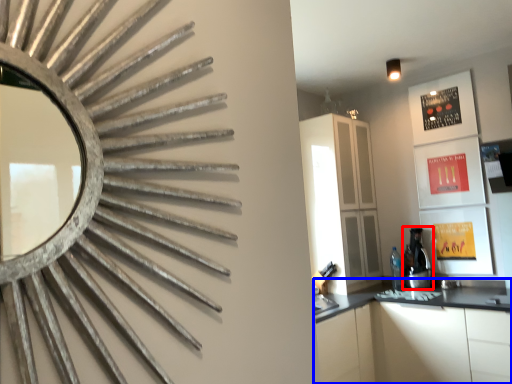
Question: Which of the following is the closest to the observer, coffee machine (highlighted by a red box) or cabinetry (highlighted by a blue box)?

Choices:
 (A) coffee machine
 (B) cabinetry

Answer: (B)